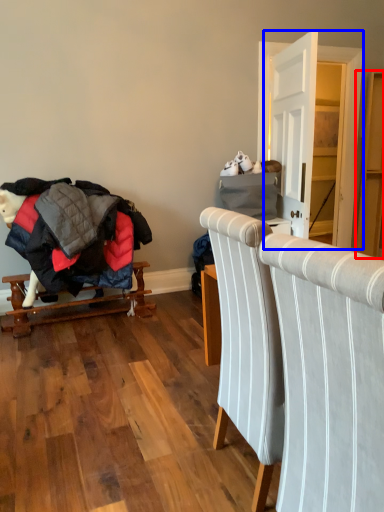
Question: Which object appears farthest to the camera in this image, dresser (highlighted by a red box) or dresser (highlighted by a blue box)?

Choices:
 (A) dresser
 (B) dresser

Answer: (A)